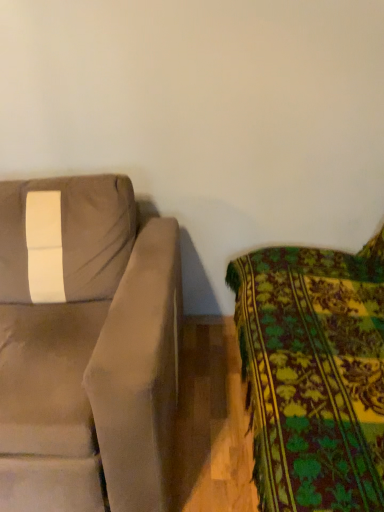
Question: Is floral fabric couch at right, which ranks as the 2th studio couch in left-to-right order, closer to the viewer compared to suede-like beige couch at left, acting as the second studio couch starting from the right?

Choices:
 (A) yes
 (B) no

Answer: (A)

Question: Is floral fabric couch at right, which ranks as the 2th studio couch in left-to-right order, taller than suede-like beige couch at left, acting as the second studio couch starting from the right?

Choices:
 (A) yes
 (B) no

Answer: (A)

Question: Does floral fabric couch at right, the first studio couch when ordered from right to left, turn towards suede-like beige couch at left, which is counted as the 1th studio couch, starting from the left?

Choices:
 (A) yes
 (B) no

Answer: (A)

Question: From the image's perspective, does floral fabric couch at right, which ranks as the 2th studio couch in left-to-right order, appear higher than suede-like beige couch at left, which is counted as the 1th studio couch, starting from the left?

Choices:
 (A) no
 (B) yes

Answer: (A)

Question: Is floral fabric couch at right, the first studio couch when ordered from right to left, bigger than suede-like beige couch at left, acting as the second studio couch starting from the right?

Choices:
 (A) yes
 (B) no

Answer: (A)

Question: Is floral fabric couch at right, which ranks as the 2th studio couch in left-to-right order, outside of suede-like beige couch at left, which is counted as the 1th studio couch, starting from the left?

Choices:
 (A) yes
 (B) no

Answer: (A)

Question: From a real-world perspective, is suede-like beige couch at left, acting as the second studio couch starting from the right, over floral fabric couch at right, the first studio couch when ordered from right to left?

Choices:
 (A) no
 (B) yes

Answer: (A)

Question: Could you tell me if suede-like beige couch at left, which is counted as the 1th studio couch, starting from the left, is facing floral fabric couch at right, the first studio couch when ordered from right to left?

Choices:
 (A) yes
 (B) no

Answer: (B)

Question: Is suede-like beige couch at left, which is counted as the 1th studio couch, starting from the left, to the left of floral fabric couch at right, the first studio couch when ordered from right to left, from the viewer's perspective?

Choices:
 (A) yes
 (B) no

Answer: (A)

Question: Considering the relative sizes of suede-like beige couch at left, which is counted as the 1th studio couch, starting from the left, and floral fabric couch at right, which ranks as the 2th studio couch in left-to-right order, in the image provided, is suede-like beige couch at left, which is counted as the 1th studio couch, starting from the left, taller than floral fabric couch at right, which ranks as the 2th studio couch in left-to-right order,?

Choices:
 (A) yes
 (B) no

Answer: (B)

Question: From the image's perspective, would you say suede-like beige couch at left, which is counted as the 1th studio couch, starting from the left, is shown under floral fabric couch at right, the first studio couch when ordered from right to left?

Choices:
 (A) no
 (B) yes

Answer: (A)

Question: From the image's perspective, is suede-like beige couch at left, acting as the second studio couch starting from the right, over floral fabric couch at right, which ranks as the 2th studio couch in left-to-right order?

Choices:
 (A) no
 (B) yes

Answer: (B)

Question: Would you say floral fabric couch at right, which ranks as the 2th studio couch in left-to-right order, is to the left or to the right of suede-like beige couch at left, acting as the second studio couch starting from the right, in the picture?

Choices:
 (A) left
 (B) right

Answer: (B)